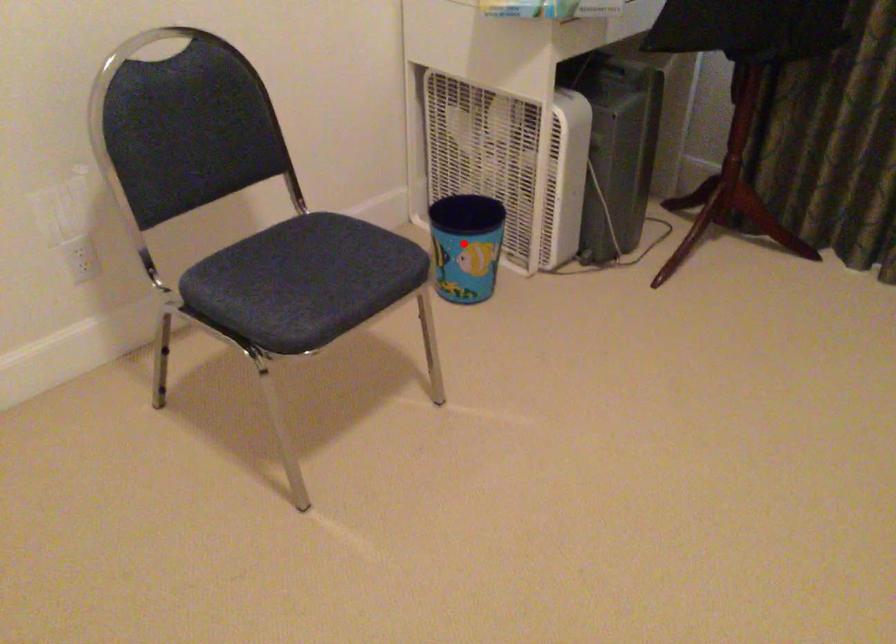
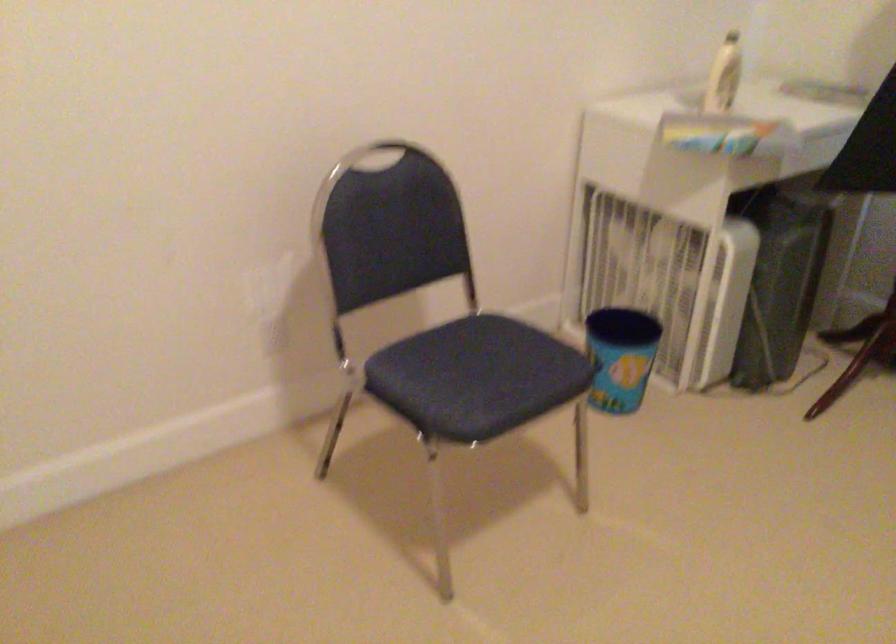
Find the pixel in the second image that matches the highlighted location in the first image.

(619, 357)